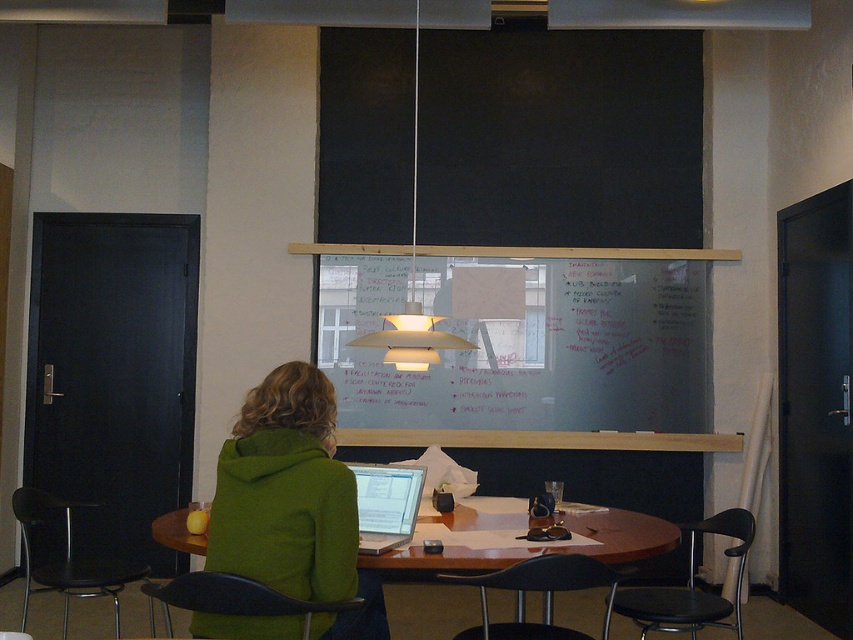
Question: Which point is closer to the camera?

Choices:
 (A) black plastic chair at lower right
 (B) transparent glass whiteboard at center
 (C) wooden table at center
 (D) black plastic chair at lower center

Answer: (D)

Question: Among these points, which one is farthest from the camera?

Choices:
 (A) (387, 256)
 (B) (560, 634)

Answer: (A)

Question: Is wooden table at center wider than black plastic chair at left?

Choices:
 (A) yes
 (B) no

Answer: (A)

Question: Can you confirm if green hoodie at center is positioned to the left of black plastic chair at lower right?

Choices:
 (A) yes
 (B) no

Answer: (A)

Question: Which object is the farthest from the green hoodie at center?

Choices:
 (A) black plastic chair at lower left
 (B) silver metallic laptop at center
 (C) transparent glass whiteboard at center

Answer: (C)

Question: Does green hoodie at center have a greater width compared to black plastic chair at lower left?

Choices:
 (A) no
 (B) yes

Answer: (A)